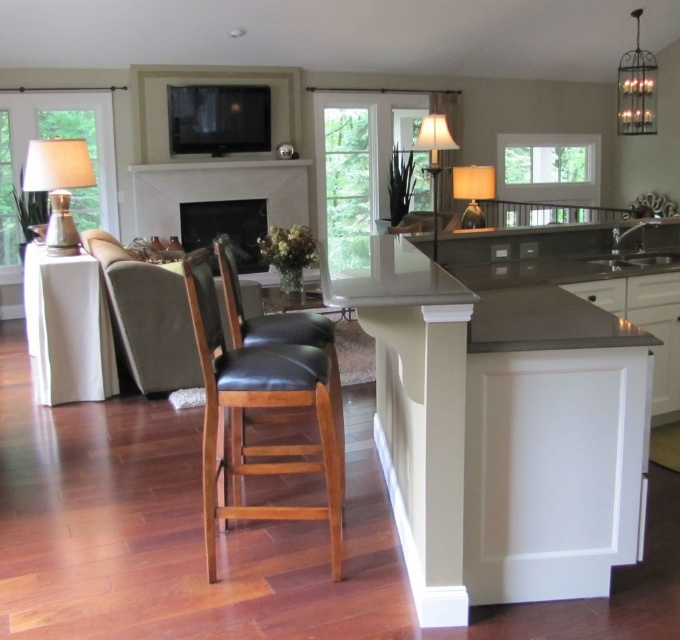
Question: Can you confirm if black leather chair at center is positioned above white marble fireplace at center?

Choices:
 (A) yes
 (B) no

Answer: (B)

Question: Which object is the farthest from the smooth gray countertop at center?

Choices:
 (A) black leather chair at center
 (B) metallic chandelier at upper right
 (C) matte silver lamp at left

Answer: (B)

Question: Which point is farther to the camera?

Choices:
 (A) (391, 490)
 (B) (218, 385)
 (C) (37, 150)
 (D) (175, 209)

Answer: (D)

Question: Does smooth gray countertop at center appear over black leather chair at center?

Choices:
 (A) yes
 (B) no

Answer: (A)

Question: Can you confirm if black leather chair at center is positioned to the left of white marble fireplace at center?

Choices:
 (A) no
 (B) yes

Answer: (A)

Question: Among these objects, which one is farthest from the camera?

Choices:
 (A) metallic chandelier at upper right
 (B) matte silver lamp at left
 (C) dark gray polished stone counter top at center

Answer: (A)